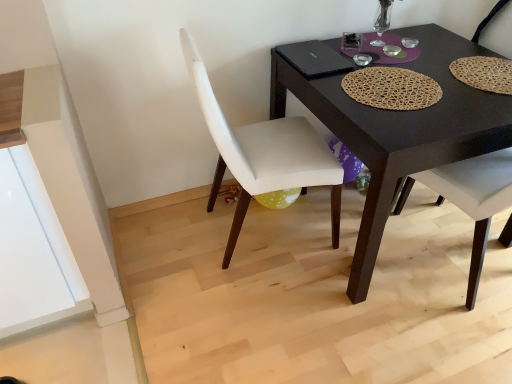
Identify the location of vacant space underneath white leather chair at center, which is the 1th chair from left to right (from a real-world perspective). The height and width of the screenshot is (384, 512). (258, 234).